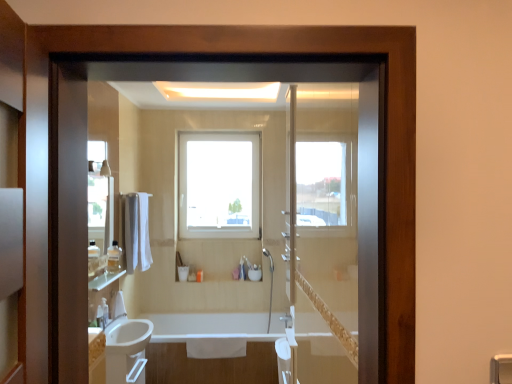
Question: Considering their positions, is white glossy bathtub at lower center located in front of or behind clear glass mirror at upper left?

Choices:
 (A) front
 (B) behind

Answer: (B)

Question: Is point (325, 342) closer or farther from the camera than point (113, 193)?

Choices:
 (A) farther
 (B) closer

Answer: (B)

Question: Which object is positioned farthest from the clear glass shelf at left?

Choices:
 (A) white glossy bathtub at lower center
 (B) clear plastic bottle at lower left, positioned as the second toiletry in top-to-bottom order
 (C) translucent plastic bottle at left, which is the second toiletry in back-to-front order
 (D) clear glass mirror at upper left
 (E) white matte cup at center, the third toiletry viewed from the front

Answer: (E)

Question: Estimate the real-world distances between objects in this image. Which object is farther from the white matte cup at center, which is the first toiletry in bottom-to-top order?

Choices:
 (A) clear glass mirror at upper left
 (B) translucent plastic bottle at left, which is the second toiletry in back-to-front order
 (C) clear glass shelf at left
 (D) clear plastic bottle at lower left, the third toiletry viewed from the right
 (E) transparent glass window at center

Answer: (A)